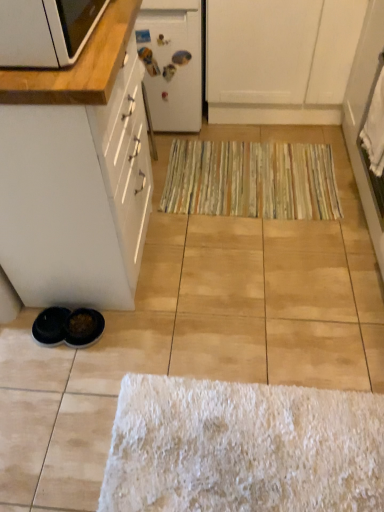
Looking at this image, what is the approximate width of matte wood countertop at upper left?

matte wood countertop at upper left is 37.14 centimeters in width.

Measure the distance between white matte cabinet at lower left, the 1th cabinetry when ordered from front to back, and camera.

white matte cabinet at lower left, the 1th cabinetry when ordered from front to back, is 36.25 inches away from camera.

Identify the location of white matte cabinet at lower left, the 1th cabinetry when ordered from left to right. The height and width of the screenshot is (512, 384). (77, 173).

Image resolution: width=384 pixels, height=512 pixels. I want to click on matte wood countertop at upper left, so click(x=78, y=66).

Is white matte refrigerator at upper center taller or shorter than matte wood countertop at upper left?

In the image, white matte refrigerator at upper center appears to be taller than matte wood countertop at upper left.

Between white matte refrigerator at upper center and matte wood countertop at upper left, which one has larger size?

Bigger between the two is white matte refrigerator at upper center.

How far apart are white matte refrigerator at upper center and matte wood countertop at upper left?

white matte refrigerator at upper center is 89.02 centimeters away from matte wood countertop at upper left.

Consider the image. How many degrees apart are the facing directions of white matte refrigerator at upper center and matte wood countertop at upper left?

The facing directions of white matte refrigerator at upper center and matte wood countertop at upper left are 88.1 degrees apart.

Between matte wood countertop at upper left and white matte cabinet at lower left, the second cabinetry from the back, which one appears on the right side from the viewer's perspective?

From the viewer's perspective, matte wood countertop at upper left appears more on the right side.

Is matte wood countertop at upper left spatially inside white matte cabinet at lower left, the 1th cabinetry when ordered from left to right, or outside of it?

matte wood countertop at upper left lies outside white matte cabinet at lower left, the 1th cabinetry when ordered from left to right.

Considering the sizes of objects matte wood countertop at upper left and white matte cabinet at lower left, placed as the 2th cabinetry when sorted from top to bottom, in the image provided, who is thinner, matte wood countertop at upper left or white matte cabinet at lower left, placed as the 2th cabinetry when sorted from top to bottom,?

With smaller width is matte wood countertop at upper left.

Between matte wood countertop at upper left and white matte cabinet at lower left, the second cabinetry from the back, which one has smaller size?

matte wood countertop at upper left is smaller.

Between striped fabric doormat at center and white matte cabinet at lower left, placed as the 2th cabinetry when sorted from top to bottom, which one has more height?

white matte cabinet at lower left, placed as the 2th cabinetry when sorted from top to bottom, is taller.

Do you think striped fabric doormat at center is within white matte cabinet at lower left, the second cabinetry from the back, or outside of it?

striped fabric doormat at center lies outside white matte cabinet at lower left, the second cabinetry from the back.

Is striped fabric doormat at center to the left or to the right of white matte cabinet at lower left, the 1th cabinetry when ordered from left to right, in the image?

In the image, striped fabric doormat at center appears on the right side of white matte cabinet at lower left, the 1th cabinetry when ordered from left to right.

Would you consider striped fabric doormat at center to be distant from white matte cabinet at lower left, which is counted as the 2th cabinetry, starting from the right?

No, striped fabric doormat at center is not far from white matte cabinet at lower left, which is counted as the 2th cabinetry, starting from the right.

You are a GUI agent. You are given a task and a screenshot of the screen. Output one action in this format:
    pyautogui.click(x=<x>, y=<y>)
    Task: Click on the countertop on the left of the white matte refrigerator at upper center
    The width and height of the screenshot is (384, 512).
    Given the screenshot: What is the action you would take?
    78,66

Is matte wood countertop at upper left positioned beyond the bounds of white matte refrigerator at upper center?

matte wood countertop at upper left lies outside white matte refrigerator at upper center's area.

In terms of height, does matte wood countertop at upper left look taller or shorter compared to white matte refrigerator at upper center?

Considering their sizes, matte wood countertop at upper left has less height than white matte refrigerator at upper center.

Is matte wood countertop at upper left facing towards white matte refrigerator at upper center?

No.

From a real-world perspective, who is located higher, white matte cabinet at lower left, the second cabinetry from the back, or striped fabric doormat at center?

white matte cabinet at lower left, the second cabinetry from the back, is physically above.

In the scene shown: Considering the sizes of objects white matte cabinet at lower left, the second cabinetry from the back, and striped fabric doormat at center in the image provided, who is smaller, white matte cabinet at lower left, the second cabinetry from the back, or striped fabric doormat at center?

striped fabric doormat at center.

Is point (140, 182) more distant than point (221, 159)?

That is False.

Is white matte cabinet at lower left, which is counted as the 2th cabinetry, starting from the right, inside or outside of white matte cabinet at upper center, which ranks as the 2th cabinetry in front-to-back order?

white matte cabinet at lower left, which is counted as the 2th cabinetry, starting from the right, exists outside the volume of white matte cabinet at upper center, which ranks as the 2th cabinetry in front-to-back order.

Does white matte cabinet at lower left, which is counted as the 2th cabinetry, starting from the right, have a greater height compared to white matte cabinet at upper center, which ranks as the 2th cabinetry in front-to-back order?

Correct, white matte cabinet at lower left, which is counted as the 2th cabinetry, starting from the right, is much taller as white matte cabinet at upper center, which ranks as the 2th cabinetry in front-to-back order.

Based on the photo, which is less distant, [115,153] or [308,101]?

Point [115,153] is positioned closer to the camera compared to point [308,101].

Is white matte cabinet at lower left, the 1th cabinetry when ordered from front to back, smaller than white matte cabinet at upper center, acting as the 2th cabinetry starting from the bottom?

Correct, white matte cabinet at lower left, the 1th cabinetry when ordered from front to back, occupies less space than white matte cabinet at upper center, acting as the 2th cabinetry starting from the bottom.

Is white matte refrigerator at upper center further to camera compared to white matte cabinet at lower left, placed as the 2th cabinetry when sorted from top to bottom?

Yes.

Which of these two, white matte refrigerator at upper center or white matte cabinet at lower left, the 1th cabinetry when ordered from front to back, stands taller?

white matte cabinet at lower left, the 1th cabinetry when ordered from front to back.

What's the angular difference between white matte refrigerator at upper center and white matte cabinet at lower left, the 1th cabinetry when ordered from front to back,'s facing directions?

The angular difference between white matte refrigerator at upper center and white matte cabinet at lower left, the 1th cabinetry when ordered from front to back, is 89.7 degrees.

Where is `countertop that appears below the white matte refrigerator at upper center (from the image's perspective)`? The height and width of the screenshot is (512, 384). countertop that appears below the white matte refrigerator at upper center (from the image's perspective) is located at coordinates (78, 66).

Where is `the 1st cabinetry positioned below the matte wood countertop at upper left (from a real-world perspective)`? This screenshot has width=384, height=512. the 1st cabinetry positioned below the matte wood countertop at upper left (from a real-world perspective) is located at coordinates (77, 173).

Estimate the real-world distances between objects in this image. Which object is closer to matte wood countertop at upper left, white matte refrigerator at upper center or white matte cabinet at lower left, the 1th cabinetry when ordered from left to right?

white matte cabinet at lower left, the 1th cabinetry when ordered from left to right, is closer to matte wood countertop at upper left.

Considering their positions, is matte wood countertop at upper left positioned closer to white matte cabinet at upper center, which is the 1th cabinetry in back-to-front order, than striped fabric doormat at center?

striped fabric doormat at center.

Looking at the image, which one is located further to white matte cabinet at upper center, which is the first cabinetry in top-to-bottom order, white matte cabinet at lower left, placed as the 2th cabinetry when sorted from top to bottom, or matte wood countertop at upper left?

matte wood countertop at upper left is further to white matte cabinet at upper center, which is the first cabinetry in top-to-bottom order.

Based on the photo, considering their positions, is matte wood countertop at upper left positioned closer to white matte cabinet at upper center, the first cabinetry when ordered from right to left, than white matte cabinet at lower left, the second cabinetry from the back?

white matte cabinet at lower left, the second cabinetry from the back, is positioned closer to the anchor white matte cabinet at upper center, the first cabinetry when ordered from right to left.

When comparing their distances from white matte cabinet at lower left, the second cabinetry from the back, does white matte cabinet at upper center, which is the 1th cabinetry in back-to-front order, or white matte refrigerator at upper center seem further?

The object further to white matte cabinet at lower left, the second cabinetry from the back, is white matte cabinet at upper center, which is the 1th cabinetry in back-to-front order.

From the image, which object appears to be farther from white matte cabinet at upper center, the first cabinetry when ordered from right to left, white matte refrigerator at upper center or striped fabric doormat at center?

Based on the image, striped fabric doormat at center appears to be further to white matte cabinet at upper center, the first cabinetry when ordered from right to left.

Estimate the real-world distances between objects in this image. Which object is further from striped fabric doormat at center, matte wood countertop at upper left or white matte refrigerator at upper center?

The object further to striped fabric doormat at center is matte wood countertop at upper left.

Based on their spatial positions, is white matte cabinet at upper center, arranged as the second cabinetry when viewed from the left, or white matte refrigerator at upper center further from striped fabric doormat at center?

white matte refrigerator at upper center is further to striped fabric doormat at center.

The height and width of the screenshot is (512, 384). I want to click on cabinetry between matte wood countertop at upper left and white matte cabinet at upper center, which is the first cabinetry in top-to-bottom order, along the z-axis, so click(77, 173).

Locate an element on the screen. The height and width of the screenshot is (512, 384). appliance positioned between matte wood countertop at upper left and white matte cabinet at upper center, which is the 1th cabinetry in back-to-front order, from near to far is located at coordinates (172, 62).

This screenshot has width=384, height=512. What are the coordinates of `appliance that lies between white matte cabinet at upper center, the first cabinetry when ordered from right to left, and striped fabric doormat at center from top to bottom` in the screenshot? It's located at (172, 62).

Find the location of a particular element. The image size is (384, 512). appliance between white matte cabinet at lower left, the 1th cabinetry when ordered from left to right, and white matte cabinet at upper center, arranged as the second cabinetry when viewed from the left, in the front-back direction is located at coordinates (172, 62).